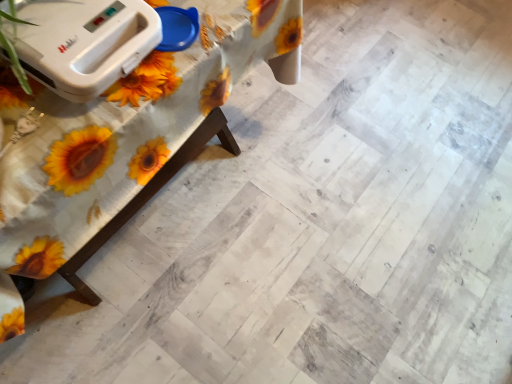
Question: Considering the relative sizes of white plastic toaster at upper left and white wood table at upper left in the image provided, is white plastic toaster at upper left thinner than white wood table at upper left?

Choices:
 (A) no
 (B) yes

Answer: (B)

Question: Is white plastic toaster at upper left wider than white wood table at upper left?

Choices:
 (A) yes
 (B) no

Answer: (B)

Question: Can you confirm if white plastic toaster at upper left is bigger than white wood table at upper left?

Choices:
 (A) no
 (B) yes

Answer: (A)

Question: Does white plastic toaster at upper left have a smaller size compared to white wood table at upper left?

Choices:
 (A) yes
 (B) no

Answer: (A)

Question: Does white plastic toaster at upper left appear on the right side of white wood table at upper left?

Choices:
 (A) yes
 (B) no

Answer: (A)

Question: Is white plastic toaster at upper left oriented towards white wood table at upper left?

Choices:
 (A) no
 (B) yes

Answer: (A)

Question: Is white wood table at upper left next to white plastic toaster at upper left and touching it?

Choices:
 (A) no
 (B) yes

Answer: (A)

Question: Could you tell me if white wood table at upper left is facing white plastic toaster at upper left?

Choices:
 (A) yes
 (B) no

Answer: (B)

Question: Is white wood table at upper left smaller than white plastic toaster at upper left?

Choices:
 (A) no
 (B) yes

Answer: (A)

Question: Is white wood table at upper left looking in the opposite direction of white plastic toaster at upper left?

Choices:
 (A) no
 (B) yes

Answer: (A)

Question: Does white wood table at upper left have a lesser height compared to white plastic toaster at upper left?

Choices:
 (A) no
 (B) yes

Answer: (A)

Question: From the image's perspective, would you say white wood table at upper left is positioned over white plastic toaster at upper left?

Choices:
 (A) no
 (B) yes

Answer: (A)

Question: Is white wood table at upper left inside the boundaries of white plastic toaster at upper left, or outside?

Choices:
 (A) outside
 (B) inside

Answer: (A)